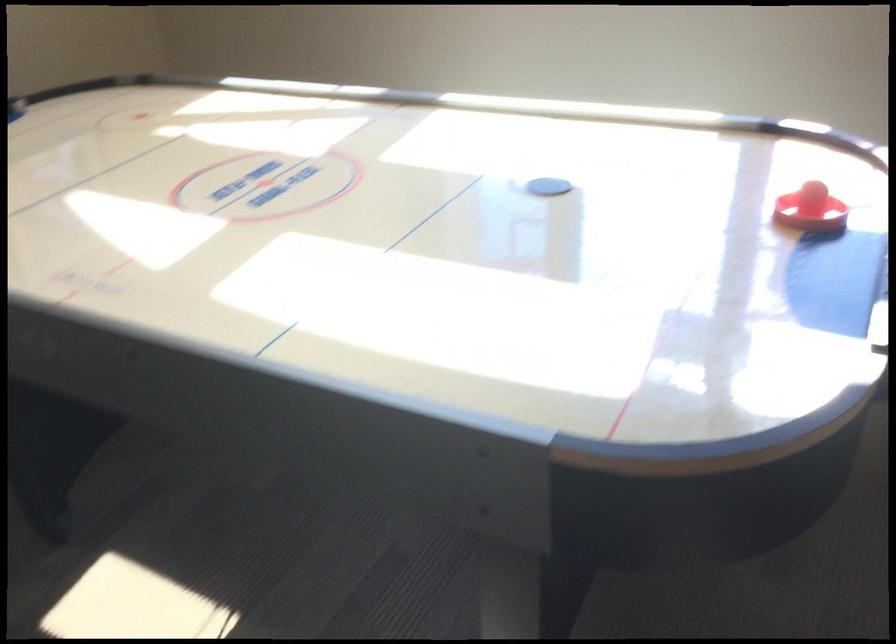
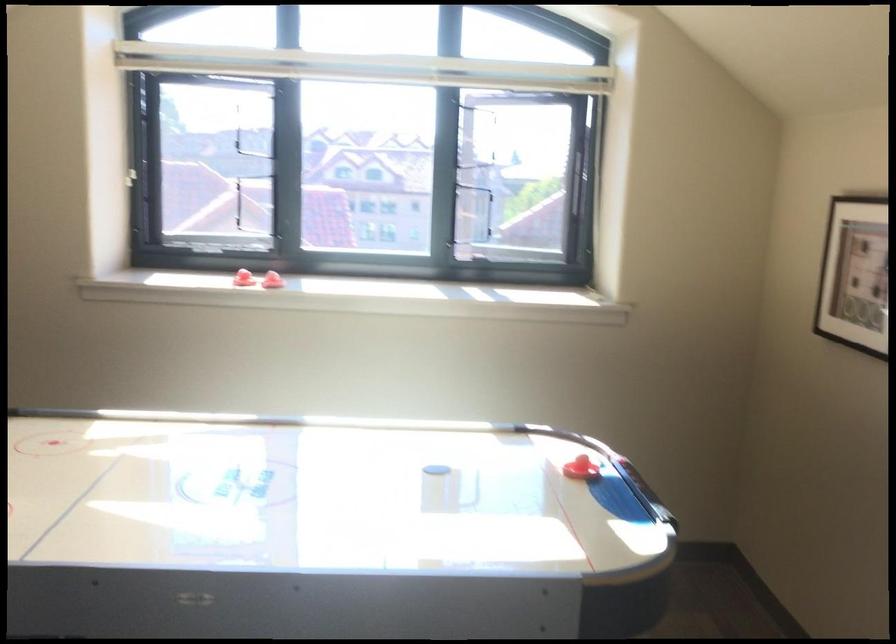
Locate, in the second image, the point that corresponds to pixel 604 187 in the first image.

(442, 467)